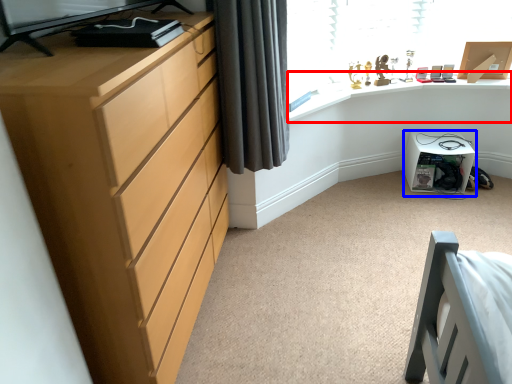
Question: Which point is closer to the camera, computer desk (highlighted by a red box) or cabinetry (highlighted by a blue box)?

Choices:
 (A) computer desk
 (B) cabinetry

Answer: (A)